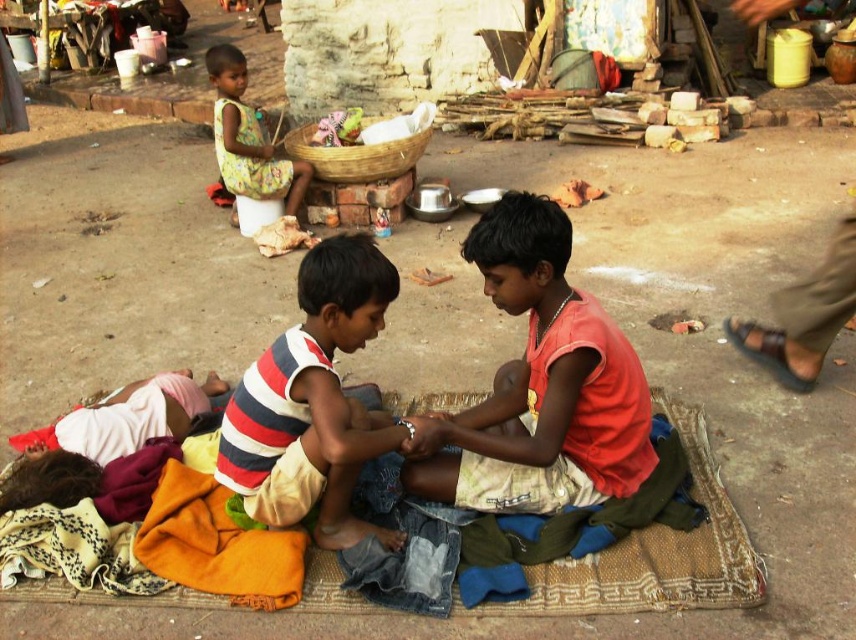
Question: Estimate the real-world distances between objects in this image. Which object is farther from the orange cotton shirt at center?

Choices:
 (A) striped fabric shirt at center
 (B) printed fabric dress at upper left
 (C) woven fabric mat at center

Answer: (B)

Question: Can you confirm if woven fabric mat at center is bigger than printed fabric dress at upper left?

Choices:
 (A) no
 (B) yes

Answer: (B)

Question: Is woven fabric mat at center smaller than printed fabric dress at upper left?

Choices:
 (A) no
 (B) yes

Answer: (A)

Question: Which point is farther from the camera taking this photo?

Choices:
 (A) (544, 369)
 (B) (301, 442)
 (C) (645, 548)

Answer: (C)

Question: Where is woven fabric mat at center located in relation to printed fabric dress at upper left in the image?

Choices:
 (A) right
 (B) left

Answer: (A)

Question: Which object appears closest to the camera in this image?

Choices:
 (A) striped fabric shirt at center
 (B) printed fabric dress at upper left
 (C) woven fabric mat at center

Answer: (A)